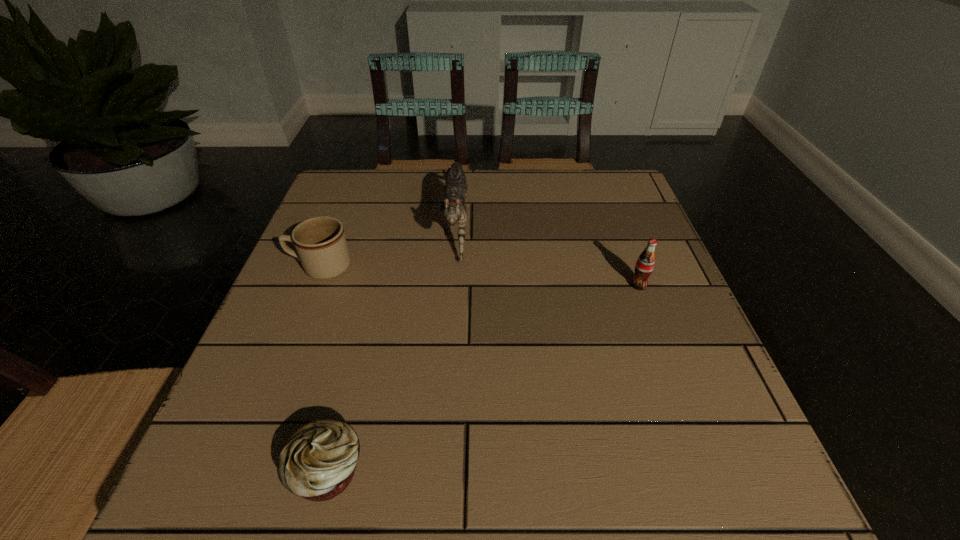
At what (x,y) coordinates should I click in order to perform the action: click on cat. Please return your answer as a coordinate pair (x, y). This screenshot has height=540, width=960. Looking at the image, I should click on (453, 209).

Image resolution: width=960 pixels, height=540 pixels. Identify the location of the tallest object. (453, 209).

The image size is (960, 540). Identify the location of soda. coord(645,263).

The image size is (960, 540). I want to click on the second shortest object, so click(x=320, y=242).

At what (x,y) coordinates should I click in order to perform the action: click on the leftmost object. Please return your answer as a coordinate pair (x, y). Image resolution: width=960 pixels, height=540 pixels. Looking at the image, I should click on (320, 242).

This screenshot has width=960, height=540. I want to click on the shortest object, so click(x=318, y=461).

The image size is (960, 540). I want to click on muffin, so click(318, 461).

The height and width of the screenshot is (540, 960). In order to click on vacant space located 0.200m on the face of the cat in this screenshot , I will do `click(448, 339)`.

Where is `free location located on the back of the soda`? Image resolution: width=960 pixels, height=540 pixels. free location located on the back of the soda is located at coordinates (612, 215).

Locate an element on the screen. This screenshot has width=960, height=540. free space located on the right of the nearest object is located at coordinates (400, 471).